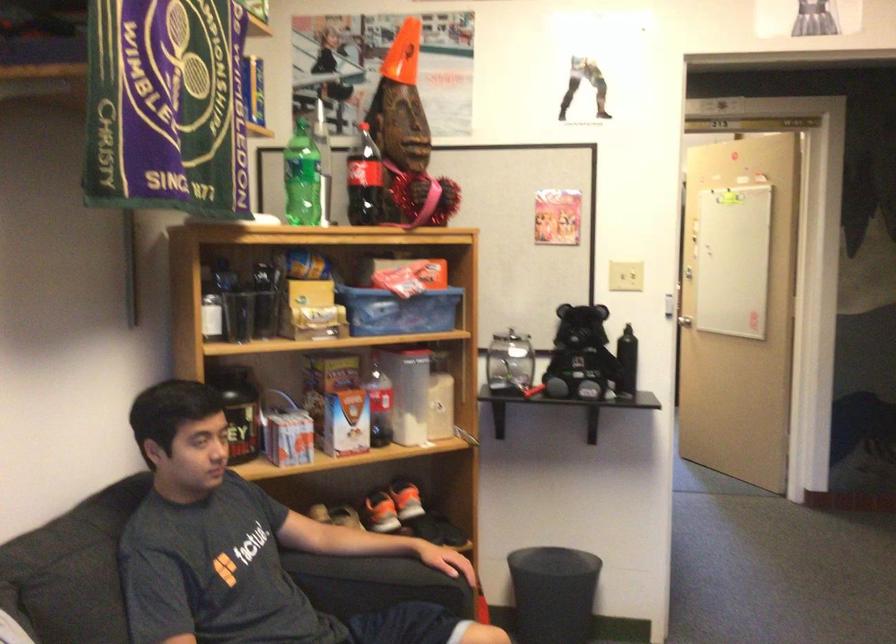
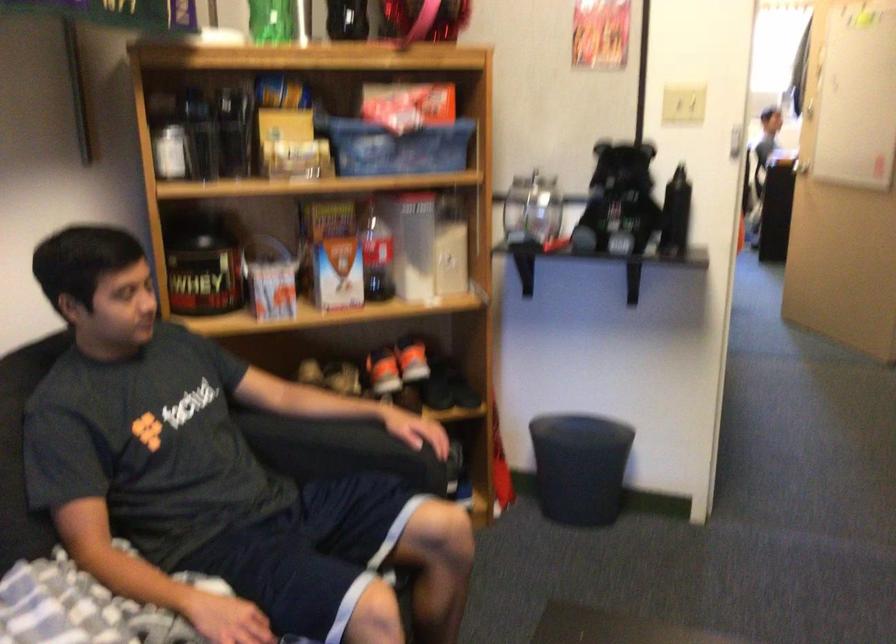
The point at (383, 509) is marked in the first image. Where is the corresponding point in the second image?

(383, 371)